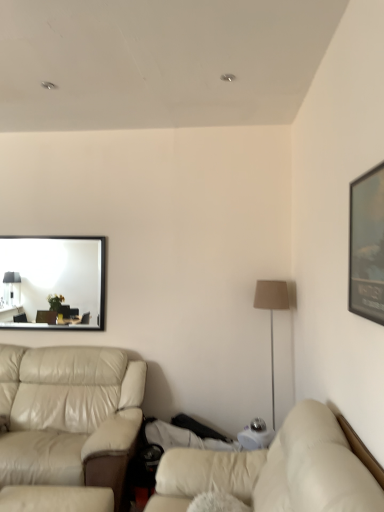
What is the approximate height of beige leather studio couch at left, positioned as the first studio couch in back-to-front order?

beige leather studio couch at left, positioned as the first studio couch in back-to-front order, is 3.38 feet tall.

Identify the location of beige leather studio couch at left, the 2th studio couch in the right-to-left sequence. The height and width of the screenshot is (512, 384). (67, 426).

The height and width of the screenshot is (512, 384). Describe the element at coordinates (52, 282) in the screenshot. I see `matte black mirror at upper left` at that location.

This screenshot has width=384, height=512. Describe the element at coordinates (367, 245) in the screenshot. I see `matte black picture frame at upper right` at that location.

Locate an element on the screen. This screenshot has height=512, width=384. beige leather studio couch at left, arranged as the second studio couch when viewed from the front is located at coordinates (67, 426).

Measure the distance between matte black picture frame at upper right and matte black mirror at upper left.

matte black picture frame at upper right and matte black mirror at upper left are 4.23 meters apart.

Find the location of a particular element. Image resolution: width=384 pixels, height=512 pixels. mirror behind the matte black picture frame at upper right is located at coordinates tap(52, 282).

From the image's perspective, between matte black picture frame at upper right and matte black mirror at upper left, who is located below?

matte black mirror at upper left.

Find the location of `the 1st studio couch in front of the matte black mirror at upper left`. the 1st studio couch in front of the matte black mirror at upper left is located at coordinates (67, 426).

Is matte black mirror at upper left wider than beige leather studio couch at left, positioned as the first studio couch in back-to-front order?

Incorrect, the width of matte black mirror at upper left does not surpass that of beige leather studio couch at left, positioned as the first studio couch in back-to-front order.

Can we say matte black mirror at upper left lies outside beige leather studio couch at left, the 2th studio couch in the right-to-left sequence?

Yes, matte black mirror at upper left is outside of beige leather studio couch at left, the 2th studio couch in the right-to-left sequence.

Does matte black mirror at upper left come behind beige leather studio couch at left, the 2th studio couch in the right-to-left sequence?

Yes, it is behind beige leather studio couch at left, the 2th studio couch in the right-to-left sequence.

Can you confirm if beige leather studio couch at left, arranged as the second studio couch when viewed from the front, is smaller than matte black mirror at upper left?

Actually, beige leather studio couch at left, arranged as the second studio couch when viewed from the front, might be larger than matte black mirror at upper left.

Locate an element on the screen. mirror above the beige leather studio couch at left, arranged as the second studio couch when viewed from the front (from the image's perspective) is located at coordinates coord(52,282).

Considering the points (76, 487) and (67, 264), which point is in front, point (76, 487) or point (67, 264)?

Point (76, 487)

Which point is more forward, (x=46, y=502) or (x=277, y=284)?

Point (x=46, y=502)

From a real-world perspective, is beige leather studio couch at left, acting as the first studio couch starting from the left, over beige fabric floor lamp at right?

Incorrect, from a real-world perspective, beige leather studio couch at left, acting as the first studio couch starting from the left, is lower than beige fabric floor lamp at right.

Could you tell me if beige leather studio couch at left, positioned as the first studio couch in back-to-front order, is turned towards beige fabric floor lamp at right?

No, beige leather studio couch at left, positioned as the first studio couch in back-to-front order, is not oriented towards beige fabric floor lamp at right.

Does beige leather studio couch at left, acting as the first studio couch starting from the left, have a smaller size compared to beige fabric floor lamp at right?

No, beige leather studio couch at left, acting as the first studio couch starting from the left, is not smaller than beige fabric floor lamp at right.

Does beige fabric floor lamp at right appear on the left side of beige leather studio couch at left, positioned as the first studio couch in back-to-front order?

Incorrect, beige fabric floor lamp at right is not on the left side of beige leather studio couch at left, positioned as the first studio couch in back-to-front order.

Considering the relative sizes of beige fabric floor lamp at right and beige leather studio couch at left, arranged as the second studio couch when viewed from the front, in the image provided, is beige fabric floor lamp at right taller than beige leather studio couch at left, arranged as the second studio couch when viewed from the front,?

Indeed, beige fabric floor lamp at right has a greater height compared to beige leather studio couch at left, arranged as the second studio couch when viewed from the front.

Is the position of beige fabric floor lamp at right more distant than that of beige leather studio couch at left, arranged as the second studio couch when viewed from the front?

Yes, it is.

At what (x,y) coordinates should I click in order to perform the action: click on studio couch that is the 2nd one below the beige fabric floor lamp at right (from a real-world perspective). Please return your answer as a coordinate pair (x, y). Looking at the image, I should click on (67, 426).

Is matte black mirror at upper left located outside beige fabric floor lamp at right?

matte black mirror at upper left lies outside beige fabric floor lamp at right's area.

Looking at this image, considering the sizes of objects matte black mirror at upper left and beige fabric floor lamp at right in the image provided, who is shorter, matte black mirror at upper left or beige fabric floor lamp at right?

matte black mirror at upper left is shorter.

Which of these two, matte black mirror at upper left or beige fabric floor lamp at right, is thinner?

With smaller width is matte black mirror at upper left.

Between beige leather couch at lower right, which is the second studio couch from back to front, and beige leather studio couch at left, positioned as the first studio couch in back-to-front order, which one has less height?

beige leather couch at lower right, which is the second studio couch from back to front, is shorter.

Looking at this image, from a real-world perspective, does beige leather couch at lower right, arranged as the 1th studio couch when viewed from the front, sit lower than beige leather studio couch at left, positioned as the first studio couch in back-to-front order?

Incorrect, from a real-world perspective, beige leather couch at lower right, arranged as the 1th studio couch when viewed from the front, is higher than beige leather studio couch at left, positioned as the first studio couch in back-to-front order.

Between beige leather couch at lower right, which is the 1th studio couch from right to left, and beige leather studio couch at left, arranged as the second studio couch when viewed from the front, which one has larger size?

Bigger between the two is beige leather studio couch at left, arranged as the second studio couch when viewed from the front.

Is there a large distance between beige leather couch at lower right, arranged as the second studio couch when viewed from the left, and beige leather studio couch at left, the 2th studio couch in the right-to-left sequence?

beige leather couch at lower right, arranged as the second studio couch when viewed from the left, is positioned a significant distance from beige leather studio couch at left, the 2th studio couch in the right-to-left sequence.

I want to click on mirror that appears behind the matte black picture frame at upper right, so click(52, 282).

In order to click on the 1st studio couch counting from the right of the matte black mirror at upper left in this screenshot , I will do `click(67, 426)`.

When comparing their distances from beige leather studio couch at left, the 2th studio couch in the right-to-left sequence, does matte black mirror at upper left or beige fabric floor lamp at right seem closer?

The object closer to beige leather studio couch at left, the 2th studio couch in the right-to-left sequence, is beige fabric floor lamp at right.

Considering their positions, is beige fabric floor lamp at right positioned further to matte black mirror at upper left than beige leather couch at lower right, arranged as the 1th studio couch when viewed from the front?

beige leather couch at lower right, arranged as the 1th studio couch when viewed from the front, lies further to matte black mirror at upper left than the other object.

Considering their positions, is beige leather couch at lower right, which is the second studio couch from back to front, positioned closer to matte black picture frame at upper right than matte black mirror at upper left?

Based on the image, beige leather couch at lower right, which is the second studio couch from back to front, appears to be nearer to matte black picture frame at upper right.

Estimate the real-world distances between objects in this image. Which object is further from beige fabric floor lamp at right, beige leather studio couch at left, positioned as the first studio couch in back-to-front order, or matte black picture frame at upper right?

matte black picture frame at upper right is positioned further to the anchor beige fabric floor lamp at right.

In the scene shown: Looking at the image, which one is located closer to beige fabric floor lamp at right, matte black mirror at upper left or matte black picture frame at upper right?

The object closer to beige fabric floor lamp at right is matte black picture frame at upper right.

Estimate the real-world distances between objects in this image. Which object is further from beige leather studio couch at left, arranged as the second studio couch when viewed from the front, beige leather couch at lower right, arranged as the second studio couch when viewed from the left, or beige fabric floor lamp at right?

Based on the image, beige fabric floor lamp at right appears to be further to beige leather studio couch at left, arranged as the second studio couch when viewed from the front.

From the picture: Based on their spatial positions, is beige fabric floor lamp at right or beige leather couch at lower right, which is the 1th studio couch from right to left, closer to beige leather studio couch at left, arranged as the second studio couch when viewed from the front?

beige leather couch at lower right, which is the 1th studio couch from right to left, is positioned closer to the anchor beige leather studio couch at left, arranged as the second studio couch when viewed from the front.

Looking at the image, which one is located closer to beige fabric floor lamp at right, matte black picture frame at upper right or beige leather studio couch at left, arranged as the second studio couch when viewed from the front?

Among the two, beige leather studio couch at left, arranged as the second studio couch when viewed from the front, is located nearer to beige fabric floor lamp at right.

At what (x,y) coordinates should I click in order to perform the action: click on studio couch between matte black picture frame at upper right and matte black mirror at upper left from front to back. Please return your answer as a coordinate pair (x, y). This screenshot has height=512, width=384. Looking at the image, I should click on (67, 426).

Find the location of a particular element. This screenshot has height=512, width=384. table lamp between matte black picture frame at upper right and matte black mirror at upper left along the z-axis is located at coordinates (272, 311).

What are the coordinates of `studio couch between beige leather couch at lower right, arranged as the 1th studio couch when viewed from the front, and beige fabric floor lamp at right in the front-back direction` in the screenshot? It's located at (67, 426).

Locate an element on the screen. The image size is (384, 512). studio couch between beige leather studio couch at left, positioned as the first studio couch in back-to-front order, and matte black picture frame at upper right, in the horizontal direction is located at coordinates (277, 471).